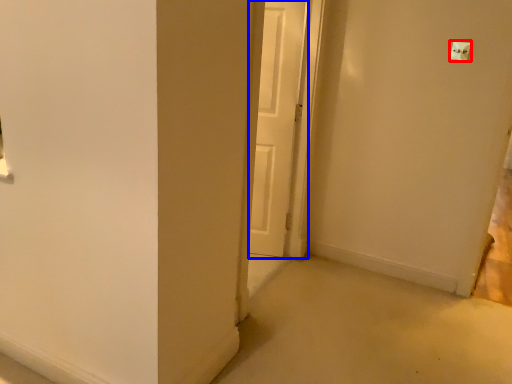
Question: Which point is closer to the camera, light switch (highlighted by a red box) or door (highlighted by a blue box)?

Choices:
 (A) light switch
 (B) door

Answer: (A)